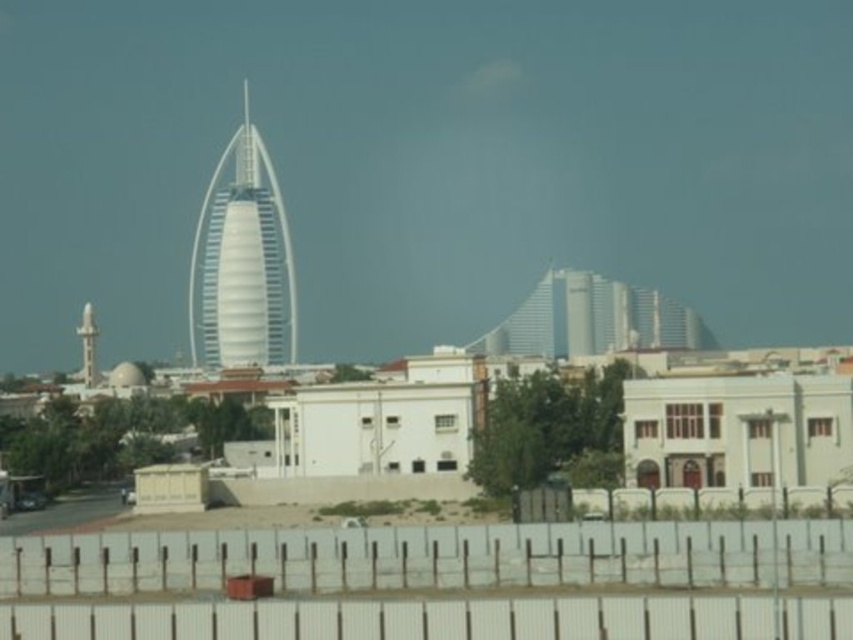
Is white plastic fence at lower center bigger than white smooth tower at center?

Actually, white plastic fence at lower center might be smaller than white smooth tower at center.

Does point (553, 536) come behind point (248, 131)?

No, (553, 536) is closer to viewer.

I want to click on white plastic fence at lower center, so click(x=436, y=557).

Which of these two, white plastic fence at lower center or white glossy minaret at upper left, stands shorter?

Standing shorter between the two is white plastic fence at lower center.

Where is `white plastic fence at lower center`? The image size is (853, 640). white plastic fence at lower center is located at coordinates (436, 557).

You are a GUI agent. You are given a task and a screenshot of the screen. Output one action in this format:
    pyautogui.click(x=<x>, y=<y>)
    Task: Click on the white plastic fence at lower center
    
    Given the screenshot: What is the action you would take?
    pyautogui.click(x=436, y=557)

Based on the photo, who is more forward, (270,168) or (90,381)?

Positioned in front is point (90,381).

Is point (268, 332) positioned before point (91, 321)?

No, it is not.

Who is more distant from viewer, (264,205) or (91,344)?

Positioned behind is point (264,205).

Find the location of `white smooth tower at center`. white smooth tower at center is located at coordinates (242, 260).